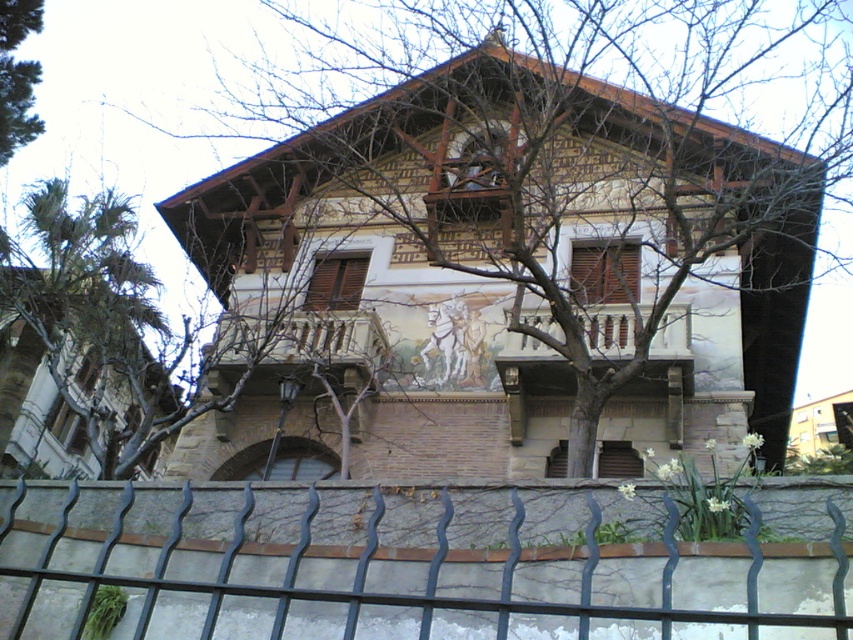
Question: Which point is farther from the camera taking this photo?

Choices:
 (A) (309, 360)
 (B) (376, 20)
 (C) (22, 33)

Answer: (B)

Question: Is wooden railing at center closer to the viewer compared to green leafy tree at upper left?

Choices:
 (A) yes
 (B) no

Answer: (A)

Question: Is brown leafless tree at center positioned behind wooden at center?

Choices:
 (A) yes
 (B) no

Answer: (B)

Question: Which object is the farthest from the brown leafless tree at center?

Choices:
 (A) wooden at center
 (B) wooden railing at center

Answer: (A)

Question: Among these points, which one is nearest to the camera?

Choices:
 (A) (608, 352)
 (B) (262, 342)

Answer: (A)

Question: In this image, where is black wrought iron fence at lower center located relative to brown leafless tree at center?

Choices:
 (A) below
 (B) above

Answer: (A)